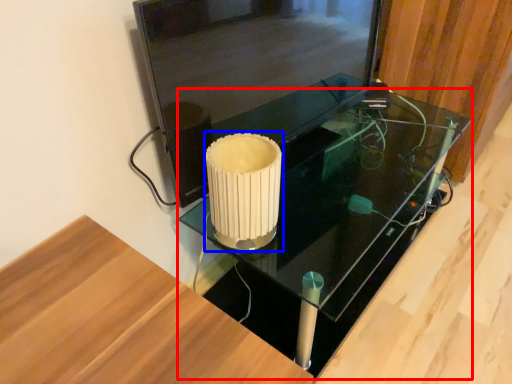
Question: Among these objects, which one is farthest to the camera, table (highlighted by a red box) or candle holder (highlighted by a blue box)?

Choices:
 (A) table
 (B) candle holder

Answer: (A)